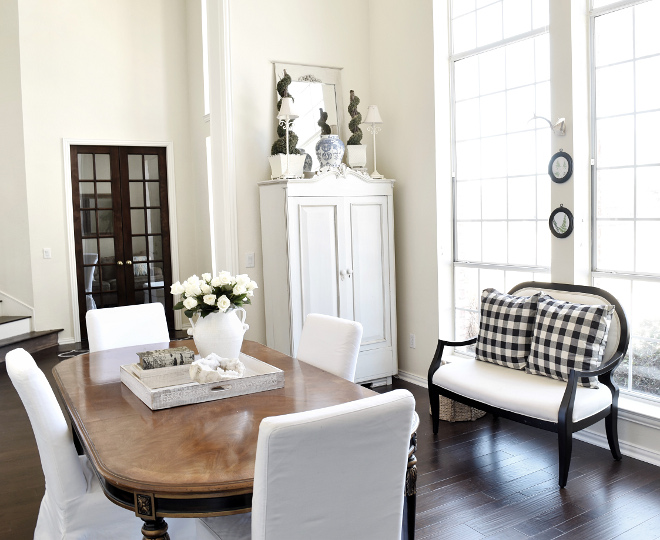
Locate an element on the screen. hard wood floor is located at coordinates (495, 503).